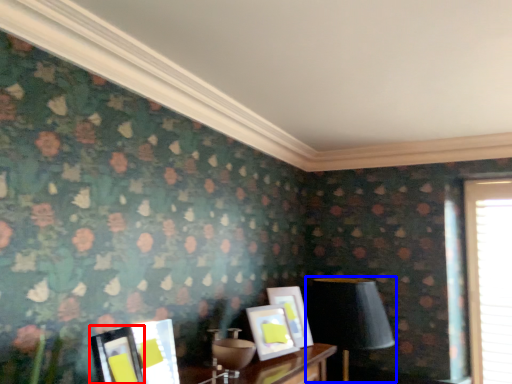
Question: Among these objects, which one is farthest to the camera, picture frame (highlighted by a red box) or table lamp (highlighted by a blue box)?

Choices:
 (A) picture frame
 (B) table lamp

Answer: (B)